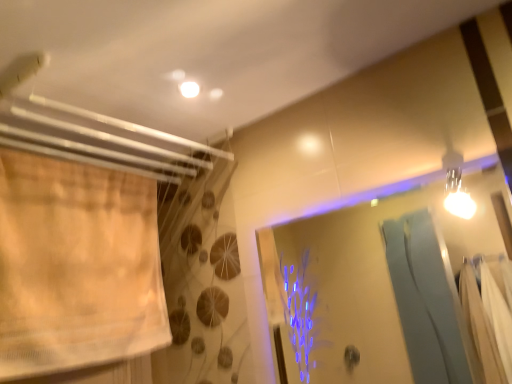
Question: Considering the positions of point (130, 319) and point (336, 213), is point (130, 319) closer or farther from the camera than point (336, 213)?

Choices:
 (A) farther
 (B) closer

Answer: (B)

Question: Based on their sizes in the image, would you say beige sheer curtain at left is bigger or smaller than transparent glass screen door at upper right?

Choices:
 (A) big
 (B) small

Answer: (A)

Question: From the image's perspective, relative to transparent glass screen door at upper right, is beige sheer curtain at left above or below?

Choices:
 (A) above
 (B) below

Answer: (A)

Question: From a real-world perspective, is transparent glass screen door at upper right positioned above or below beige sheer curtain at left?

Choices:
 (A) below
 (B) above

Answer: (A)

Question: In terms of size, does transparent glass screen door at upper right appear bigger or smaller than beige sheer curtain at left?

Choices:
 (A) small
 (B) big

Answer: (A)

Question: Choose the correct answer: Is transparent glass screen door at upper right inside beige sheer curtain at left or outside it?

Choices:
 (A) inside
 (B) outside

Answer: (B)

Question: In terms of width, does transparent glass screen door at upper right look wider or thinner when compared to beige sheer curtain at left?

Choices:
 (A) thin
 (B) wide

Answer: (A)